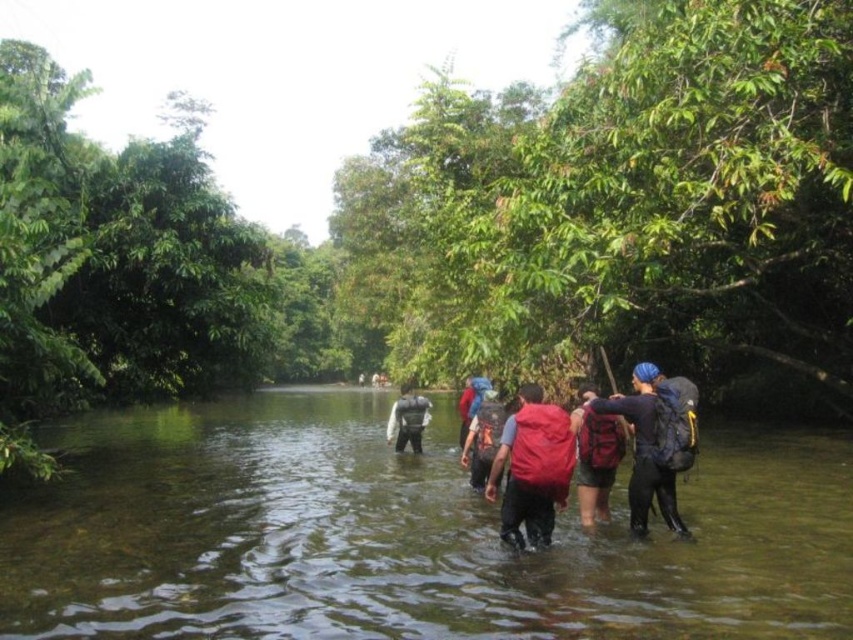
Which is more to the left, clear water stream at center or matte black backpack at center?

From the viewer's perspective, clear water stream at center appears more on the left side.

Who is positioned more to the right, clear water stream at center or matte black backpack at center?

matte black backpack at center

At what (x,y) coordinates should I click in order to perform the action: click on clear water stream at center. Please return your answer as a coordinate pair (x, y). Looking at the image, I should click on (403, 538).

Who is more forward, (x=612, y=417) or (x=409, y=396)?

Point (x=612, y=417) is more forward.

Can you confirm if red backpack at center is shorter than matte gray backpack at center?

In fact, red backpack at center may be taller than matte gray backpack at center.

Which is behind, point (596, 417) or point (418, 404)?

The point (418, 404) is more distant.

Locate an element on the screen. This screenshot has height=640, width=853. red backpack at center is located at coordinates (596, 456).

Between matte black backpack at center and matte gray backpack at center, which one is positioned lower?

matte gray backpack at center is below.

Between point (689, 385) and point (418, 442), which one is positioned behind?

The point (418, 442) is more distant.

The width and height of the screenshot is (853, 640). Identify the location of matte black backpack at center. (654, 444).